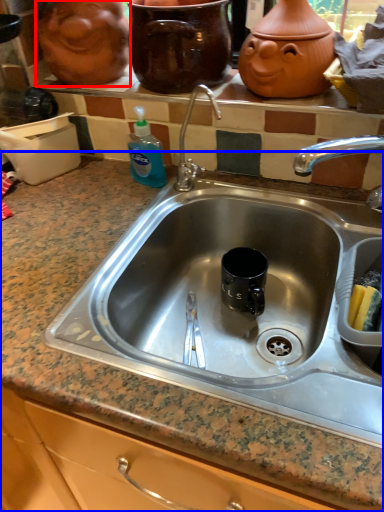
Question: Which object is closer to the camera taking this photo, face (highlighted by a red box) or countertop (highlighted by a blue box)?

Choices:
 (A) face
 (B) countertop

Answer: (B)